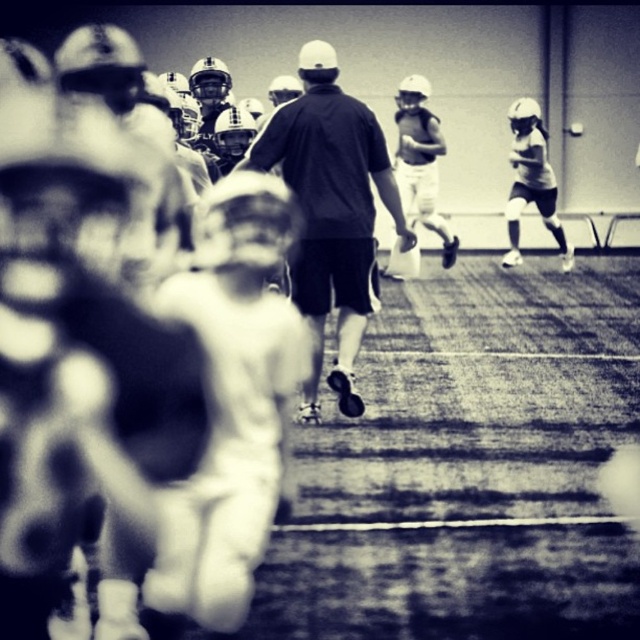
You are a photographer standing in the gymnasium during the youth football practice. You want to take a photo that includes both the point at coordinates point (413, 97) and point (529, 179). Which point is closer to your camera lens?

Point (413, 97) is closer to the camera lens than point (529, 179) because it is further to the viewer according to the description.

You are a photographer standing at the camera position. You want to capture a closeup shot of the black matte shirt at center. Given that your camera can focus on objects within 10 feet, will you be able to take the closeup?

The black matte shirt at center is 21.88 feet away from the camera. Since the camera can only focus within 10 feet, the photographer cannot take a closeup as the subject is too far away.